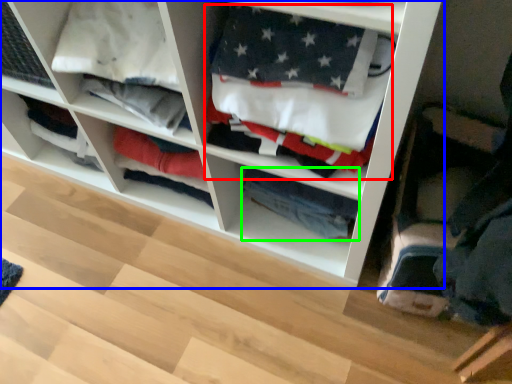
Question: Based on their relative distances, which object is farther from clothing (highlighted by a red box)? Choose from shelf (highlighted by a blue box) and clothing (highlighted by a green box).

Choices:
 (A) shelf
 (B) clothing

Answer: (B)